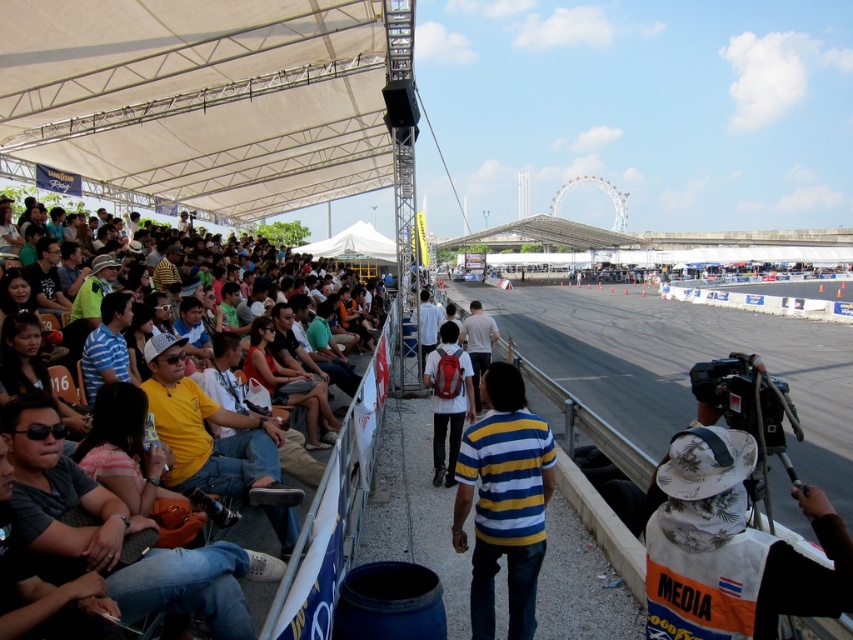
You are a photographer at the event with a camera that requires a minimum of 2.5 meters of space to operate safely. You notice the yellow striped shirt at center and the white matte backpack at center in your path. Is there enough space between them to safely maneuver your camera?

The distance between the yellow striped shirt at center and the white matte backpack at center is 3.18 meters, which exceeds the required 2.5 meters. Therefore, there is sufficient space to safely maneuver the camera between them.

You are a photographer positioned at the origin point of the coordinate system. You need to take a photo of the yellow striped shirt at center. What are the coordinates where you should aim your camera?

The yellow striped shirt at center is located at point (503, 500), so you should aim your camera at those coordinates to capture it.